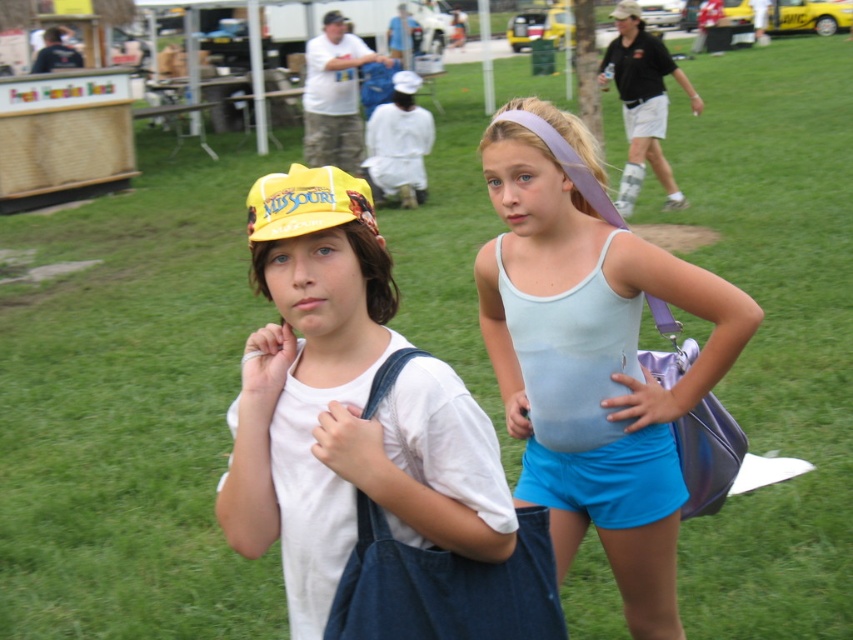
Which is more to the right, white cotton shirt at center or light blue fabric tank top at center?

light blue fabric tank top at center

Between point (421, 392) and point (486, 285), which one is positioned in front?

Positioned in front is point (421, 392).

Where is `white cotton shirt at center`? This screenshot has height=640, width=853. white cotton shirt at center is located at coordinates (345, 404).

Does white matte shirt at center have a lesser height compared to yellow fabric cap at upper center?

Yes, white matte shirt at center is shorter than yellow fabric cap at upper center.

Is point (386, 132) positioned before point (346, 19)?

That is True.

I want to click on white matte shirt at center, so click(x=399, y=144).

Is white cotton shirt at center to the left of yellow fabric cap at upper left from the viewer's perspective?

No, white cotton shirt at center is not to the left of yellow fabric cap at upper left.

Which of these two, white cotton shirt at center or yellow fabric cap at upper left, stands taller?

Standing taller between the two is white cotton shirt at center.

Locate an element on the screen. This screenshot has width=853, height=640. white cotton shirt at center is located at coordinates (345, 404).

The image size is (853, 640). Find the location of `white cotton shirt at center`. white cotton shirt at center is located at coordinates (345, 404).